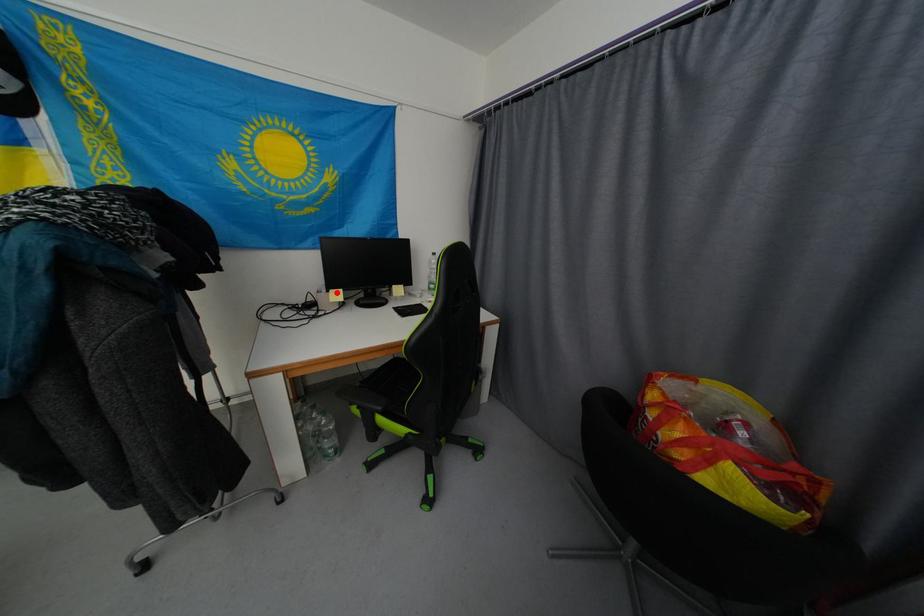
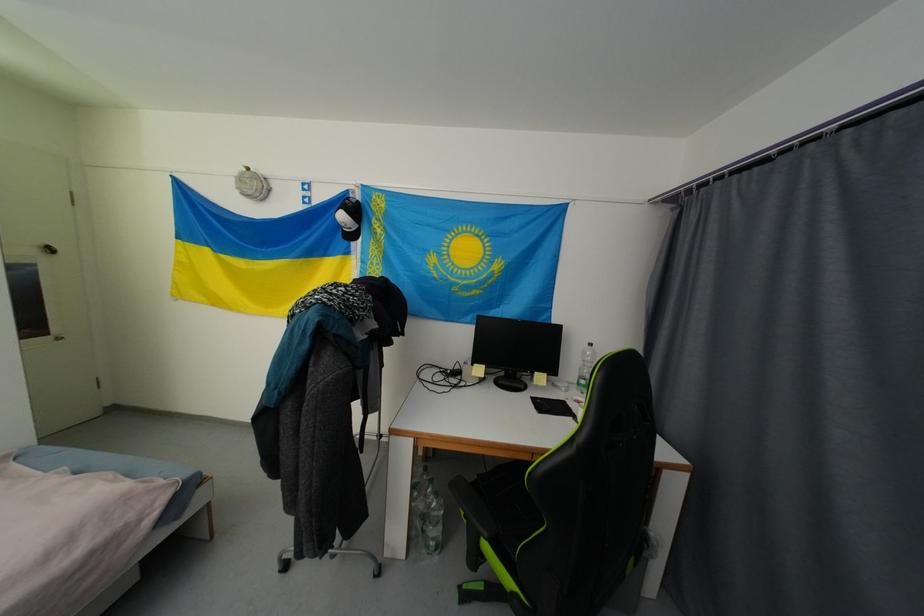
Question: I am providing you with two images of the same scene from different viewpoints. Given a red point in image1, look at the same physical point in image2. Is it:

Choices:
 (A) Closer to the viewpoint
 (B) Farther from the viewpoint

Answer: (B)